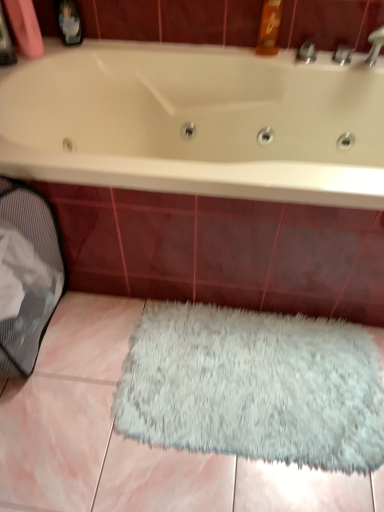
Measure the distance between point (82,51) and camera.

Point (82,51) is 1.54 meters away from camera.

Where is `white fluffy rug at lower center`? This screenshot has height=512, width=384. white fluffy rug at lower center is located at coordinates (254, 386).

What do you see at coordinates (254, 386) in the screenshot? I see `white fluffy rug at lower center` at bounding box center [254, 386].

The width and height of the screenshot is (384, 512). I want to click on white glossy bathtub at upper center, so click(x=197, y=122).

Is white fluffy rug at lower center positioned in front of gray mesh laundry basket at lower left?

No, it is not.

From the image's perspective, is white fluffy rug at lower center positioned above or below gray mesh laundry basket at lower left?

Based on their image positions, white fluffy rug at lower center is located beneath gray mesh laundry basket at lower left.

Is white fluffy rug at lower center not within gray mesh laundry basket at lower left?

That's correct, white fluffy rug at lower center is outside of gray mesh laundry basket at lower left.

Image resolution: width=384 pixels, height=512 pixels. I want to click on bathtub in front of the white fluffy rug at lower center, so click(197, 122).

Does white fluffy rug at lower center contain white glossy bathtub at upper center?

No.

Is white fluffy rug at lower center oriented towards white glossy bathtub at upper center?

No, white fluffy rug at lower center is not aimed at white glossy bathtub at upper center.

Based on the photo, from the image's perspective, is white fluffy rug at lower center positioned above or below white glossy bathtub at upper center?

Clearly, from the image's perspective, white fluffy rug at lower center is below white glossy bathtub at upper center.

Identify the location of bathtub on the right of gray mesh laundry basket at lower left. (197, 122).

Between white glossy bathtub at upper center and gray mesh laundry basket at lower left, which one appears on the left side from the viewer's perspective?

Positioned to the left is gray mesh laundry basket at lower left.

Based on their sizes in the image, would you say white glossy bathtub at upper center is bigger or smaller than gray mesh laundry basket at lower left?

Clearly, white glossy bathtub at upper center is larger in size than gray mesh laundry basket at lower left.

From a real-world perspective, is white glossy bathtub at upper center physically located above or below gray mesh laundry basket at lower left?

white glossy bathtub at upper center is above gray mesh laundry basket at lower left.

Is point (23, 240) farther from viewer compared to point (155, 167)?

Yes, it is.

Relative to white glossy bathtub at upper center, is gray mesh laundry basket at lower left in front or behind?

Clearly, gray mesh laundry basket at lower left is in front of white glossy bathtub at upper center.

I want to click on bathtub on the right of gray mesh laundry basket at lower left, so click(197, 122).

Is gray mesh laundry basket at lower left oriented away from white glossy bathtub at upper center?

No, white glossy bathtub at upper center is not at the back of gray mesh laundry basket at lower left.

From the picture: Is gray mesh laundry basket at lower left positioned far away from white fluffy rug at lower center?

No, gray mesh laundry basket at lower left is not far away from white fluffy rug at lower center.

Locate an element on the screen. laundry basket lying above the white fluffy rug at lower center (from the image's perspective) is located at coordinates (26, 275).

Considering the sizes of objects gray mesh laundry basket at lower left and white fluffy rug at lower center in the image provided, who is smaller, gray mesh laundry basket at lower left or white fluffy rug at lower center?

white fluffy rug at lower center is smaller.

From the image's perspective, which one is positioned lower, gray mesh laundry basket at lower left or white fluffy rug at lower center?

white fluffy rug at lower center is shown below in the image.

How different are the orientations of white glossy bathtub at upper center and white fluffy rug at lower center in degrees?

white glossy bathtub at upper center and white fluffy rug at lower center are facing 90.2 degrees away from each other.

Looking at this image, is white glossy bathtub at upper center situated inside white fluffy rug at lower center or outside?

white glossy bathtub at upper center is not enclosed by white fluffy rug at lower center.

Which is behind, point (87, 44) or point (148, 374)?

The point (87, 44) is more distant.

Where is `laundry basket on the left of white fluffy rug at lower center`? The width and height of the screenshot is (384, 512). laundry basket on the left of white fluffy rug at lower center is located at coordinates (26, 275).

Locate an element on the screen. This screenshot has width=384, height=512. doormat located behind the white glossy bathtub at upper center is located at coordinates pyautogui.click(x=254, y=386).

Which object lies nearer to the anchor point gray mesh laundry basket at lower left, white fluffy rug at lower center or white glossy bathtub at upper center?

white glossy bathtub at upper center lies closer to gray mesh laundry basket at lower left than the other object.

Estimate the real-world distances between objects in this image. Which object is further from white fluffy rug at lower center, gray mesh laundry basket at lower left or white glossy bathtub at upper center?

Based on the image, white glossy bathtub at upper center appears to be further to white fluffy rug at lower center.

Looking at this image, looking at the image, which one is located closer to white glossy bathtub at upper center, gray mesh laundry basket at lower left or white fluffy rug at lower center?

The object closer to white glossy bathtub at upper center is gray mesh laundry basket at lower left.

Which object lies further to the anchor point white fluffy rug at lower center, white glossy bathtub at upper center or gray mesh laundry basket at lower left?

The object further to white fluffy rug at lower center is white glossy bathtub at upper center.

When comparing their distances from gray mesh laundry basket at lower left, does white glossy bathtub at upper center or white fluffy rug at lower center seem closer?

white glossy bathtub at upper center is closer to gray mesh laundry basket at lower left.

Considering their positions, is white fluffy rug at lower center positioned closer to white glossy bathtub at upper center than gray mesh laundry basket at lower left?

gray mesh laundry basket at lower left.

I want to click on bathtub between gray mesh laundry basket at lower left and white fluffy rug at lower center, so click(197, 122).